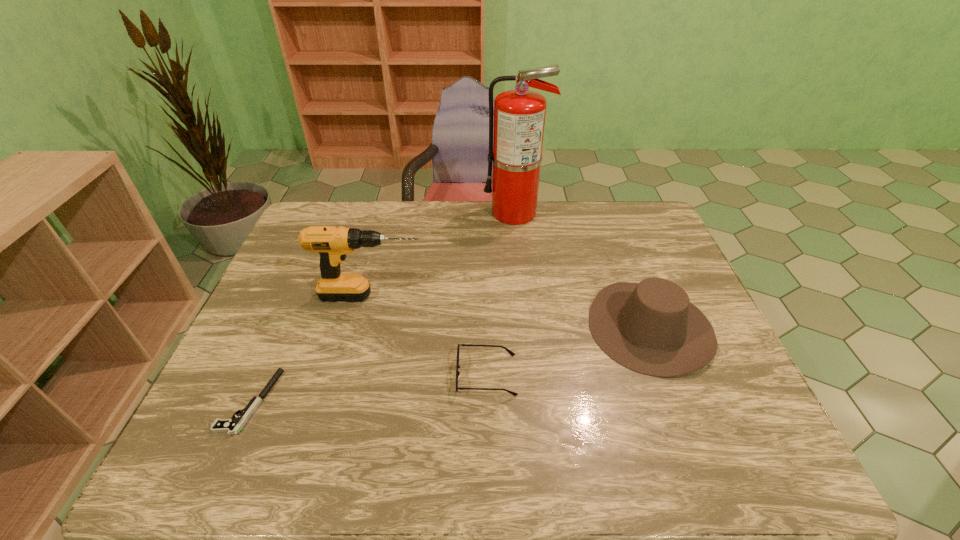
Find the location of `free spot between the fourth tallest object and the leftmost object`. free spot between the fourth tallest object and the leftmost object is located at coordinates (368, 388).

At what (x,y) coordinates should I click in order to perform the action: click on vacant area that lies between the shortest object and the rightmost object. Please return your answer as a coordinate pair (x, y). Looking at the image, I should click on (450, 364).

The image size is (960, 540). I want to click on free space between the leftmost object and the fourth shortest object, so click(310, 349).

I want to click on vacant area between the fourth object from right to left and the shortest object, so click(x=310, y=349).

At what (x,y) coordinates should I click in order to perform the action: click on free spot between the fire extinguisher and the leftmost object. Please return your answer as a coordinate pair (x, y). Looking at the image, I should click on (382, 307).

Find the location of a particular element. The height and width of the screenshot is (540, 960). vacant area that lies between the rightmost object and the shortest object is located at coordinates (450, 364).

Where is `free space that is in between the third shortest object and the fourth object from right to left`? The height and width of the screenshot is (540, 960). free space that is in between the third shortest object and the fourth object from right to left is located at coordinates (511, 312).

Where is `object that ranks as the third closest to the drill`? object that ranks as the third closest to the drill is located at coordinates (519, 115).

Where is `object that is the closest to the fourth shortest object`? object that is the closest to the fourth shortest object is located at coordinates tap(511, 353).

You are a GUI agent. You are given a task and a screenshot of the screen. Output one action in this format:
    pyautogui.click(x=<x>, y=<y>)
    Task: Click on the vacant point that satisfies the following two spatial constraints: 1. on the front side of the third tallest object; 2. on the front-facing side of the shortest object
    Image resolution: width=960 pixels, height=540 pixels.
    Given the screenshot: What is the action you would take?
    pyautogui.click(x=679, y=402)